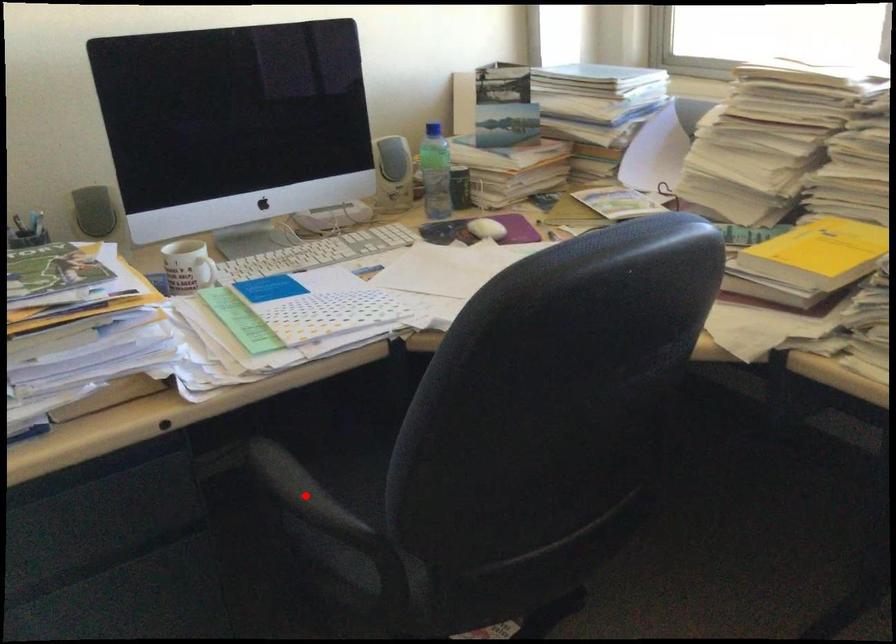
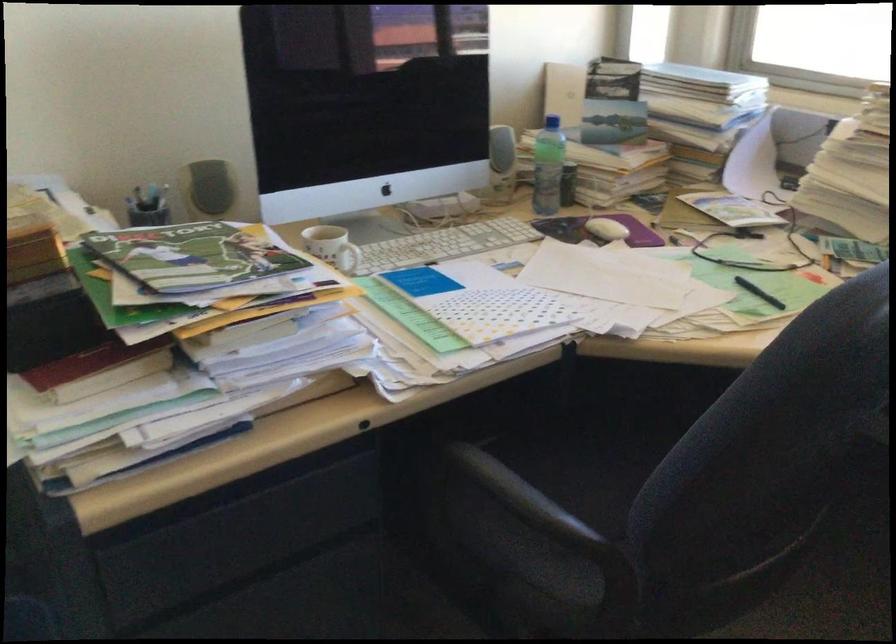
Find the pixel in the second image that matches the highlighted location in the first image.

(532, 506)